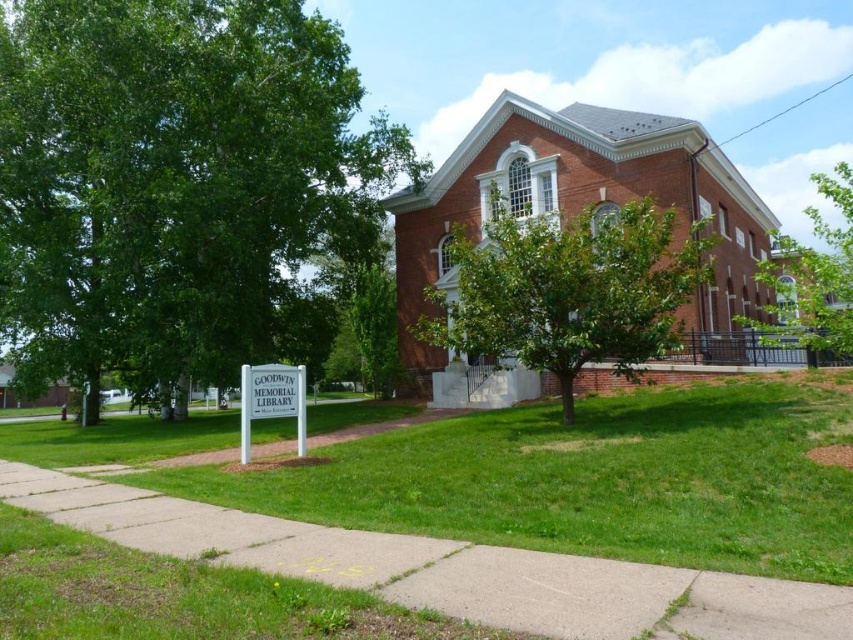
Question: Is the position of brick church at center less distant than that of green leafy tree at center?

Choices:
 (A) yes
 (B) no

Answer: (B)

Question: Is green leafy tree at left further to the viewer compared to green leafy tree at center?

Choices:
 (A) yes
 (B) no

Answer: (A)

Question: Can you confirm if green leafy tree at left is wider than brick church at center?

Choices:
 (A) no
 (B) yes

Answer: (A)

Question: Which object is positioned closest to the green leafy tree at left?

Choices:
 (A) green leafy tree at upper right
 (B) green leafy tree at center

Answer: (B)

Question: Which of the following is the closest to the observer?

Choices:
 (A) (618, 304)
 (B) (650, 156)
 (C) (62, 371)

Answer: (A)

Question: Which point is closer to the camera taking this photo?

Choices:
 (A) [119, 332]
 (B) [427, 236]
 (C) [666, 344]
 (D) [288, 410]

Answer: (D)